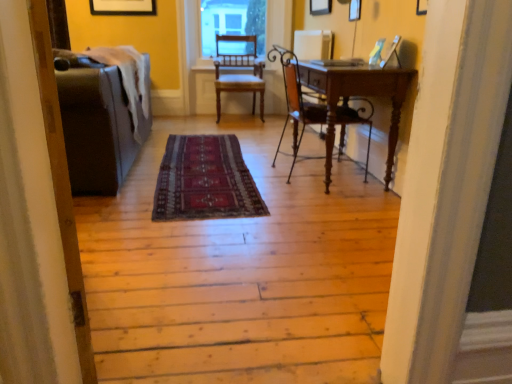
Where is `free space on the front side of wooden chair at center, the second chair positioned from the left`? free space on the front side of wooden chair at center, the second chair positioned from the left is located at coordinates (333, 198).